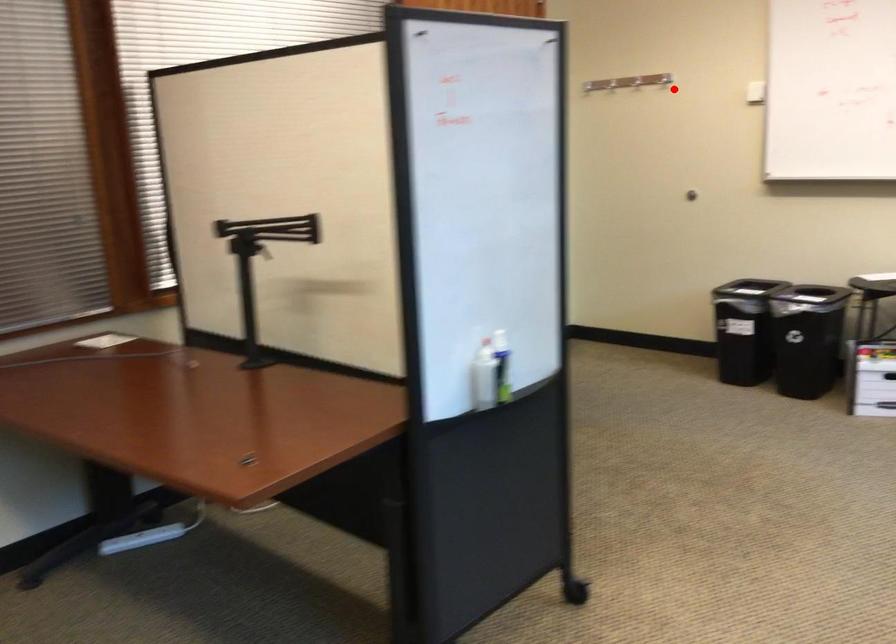
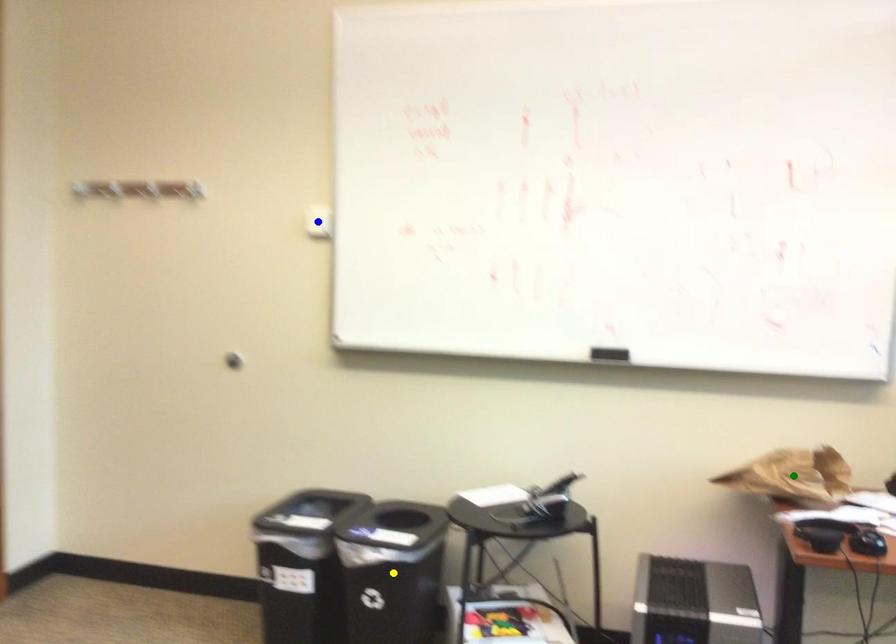
Question: I am providing you with two images of the same scene from different viewpoints. A red point is marked on the first image. You are given multiple points on the second image. Which spot in image 2 lines up with the point in image 1?

Choices:
 (A) blue point
 (B) green point
 (C) yellow point

Answer: (A)